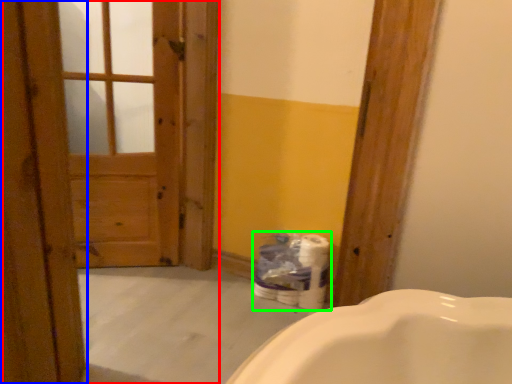
Question: Based on their relative distances, which object is farther from barn door (highlighted by a red box)? Choose from door (highlighted by a blue box) and toilet paper (highlighted by a green box).

Choices:
 (A) door
 (B) toilet paper

Answer: (A)